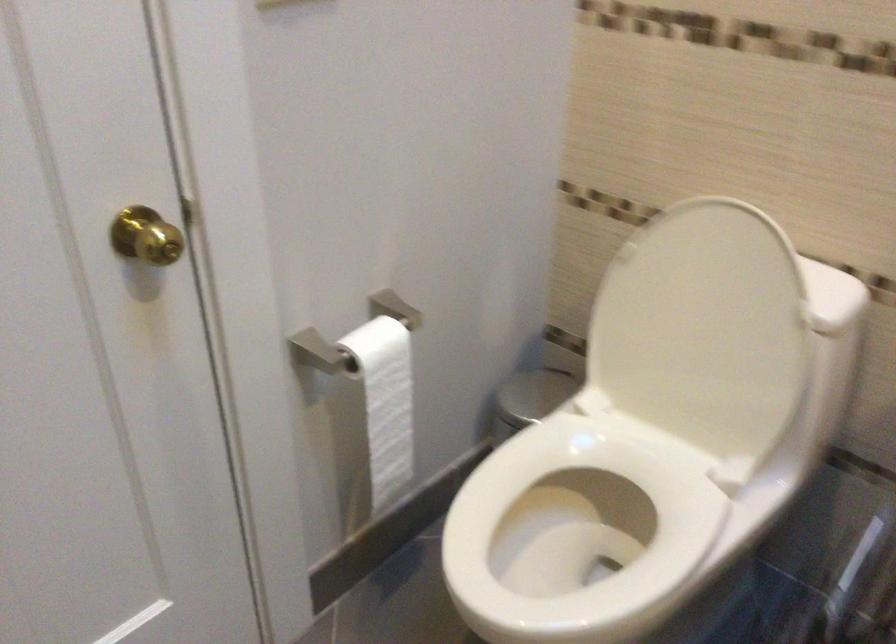
Where is `toilet lid`? This screenshot has width=896, height=644. toilet lid is located at coordinates coord(702,330).